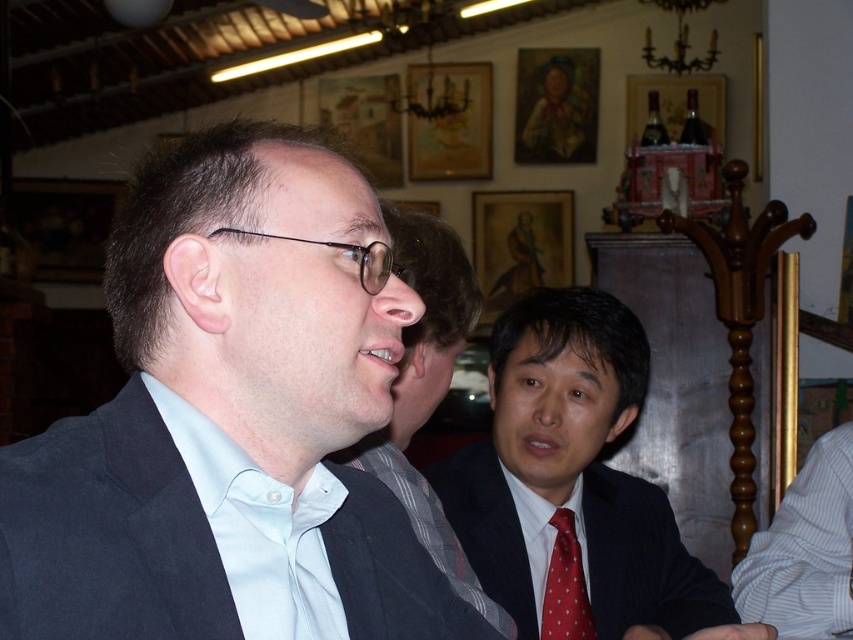
Is matte black suit at center positioned behind matte gray vest at center?

No, it is not.

Is point (178, 442) positioned in front of point (393, 394)?

Yes, it is.

Where is `matte black suit at center`? The image size is (853, 640). matte black suit at center is located at coordinates (229, 412).

Which is below, polished dark suit at center or red dotted fabric tie at center?

Positioned lower is red dotted fabric tie at center.

From the picture: Is polished dark suit at center above red dotted fabric tie at center?

Yes, polished dark suit at center is above red dotted fabric tie at center.

The height and width of the screenshot is (640, 853). I want to click on polished dark suit at center, so [575, 486].

The width and height of the screenshot is (853, 640). I want to click on polished dark suit at center, so click(x=575, y=486).

Between matte gray vest at center and white striped shirt at lower right, which one has more height?

matte gray vest at center is taller.

Who is positioned more to the right, matte gray vest at center or white striped shirt at lower right?

Positioned to the right is white striped shirt at lower right.

This screenshot has width=853, height=640. Find the location of `matte gray vest at center`. matte gray vest at center is located at coordinates (428, 392).